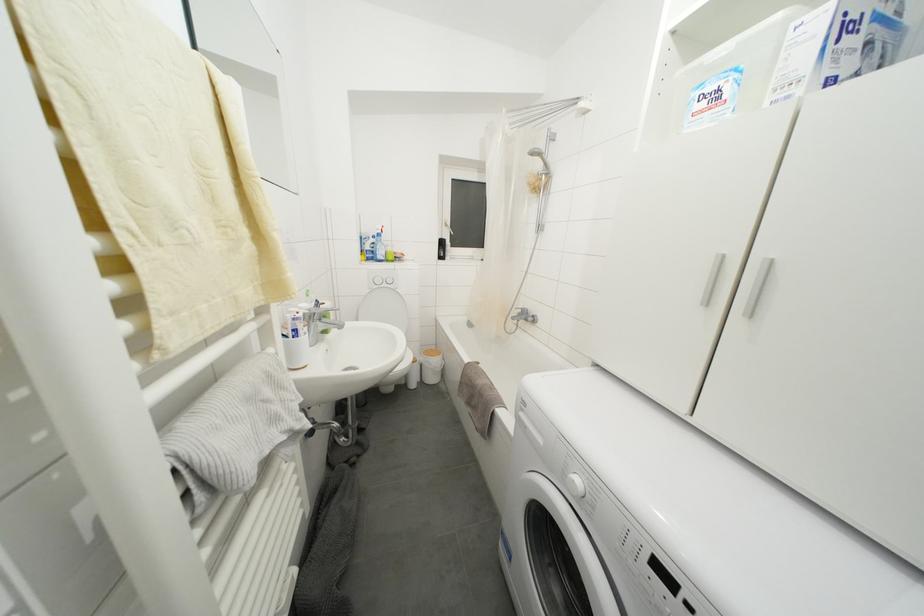
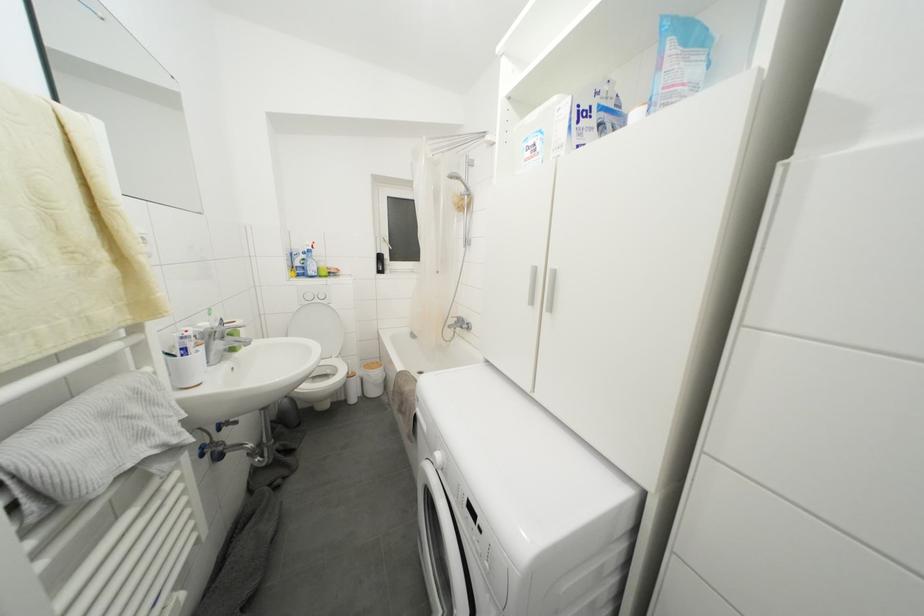
Locate, in the second image, the point that corresponds to the point at 723,102 in the first image.

(540, 155)